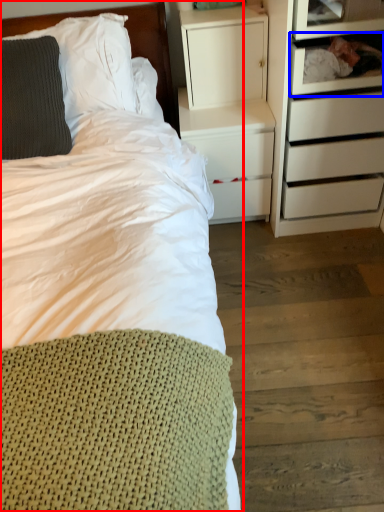
Question: Which of the following is the farthest to the observer, bed (highlighted by a red box) or shelf (highlighted by a blue box)?

Choices:
 (A) bed
 (B) shelf

Answer: (B)